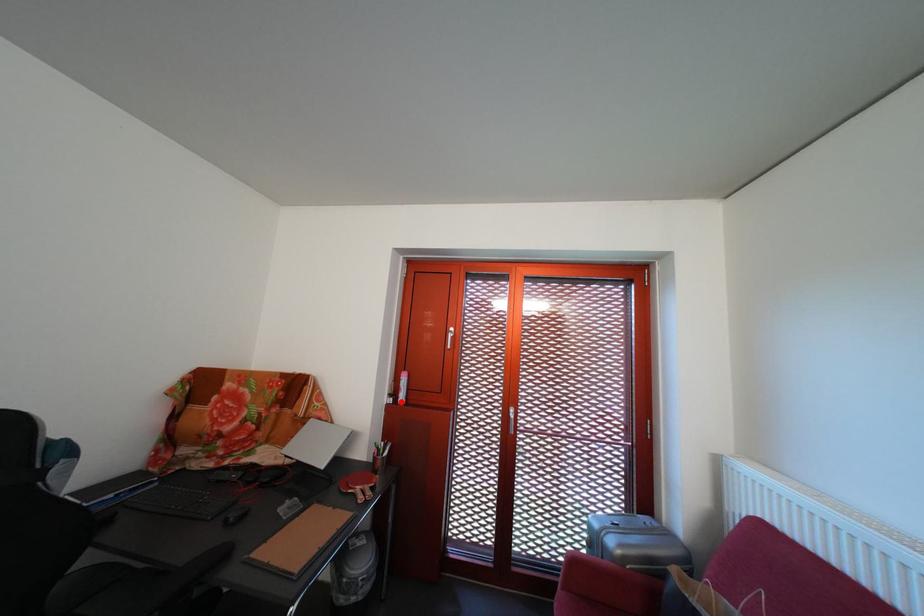
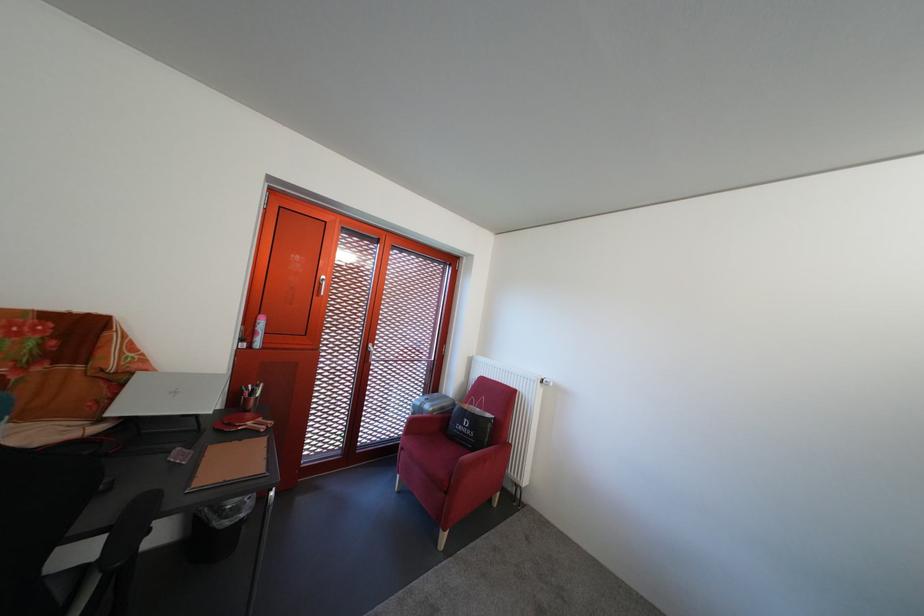
Question: I am providing you with two images of the same scene from different viewpoints. A red point is marked on the first image. At the location where the point appears in image 1, is it still visible in image 2?

Choices:
 (A) Yes
 (B) No

Answer: (A)